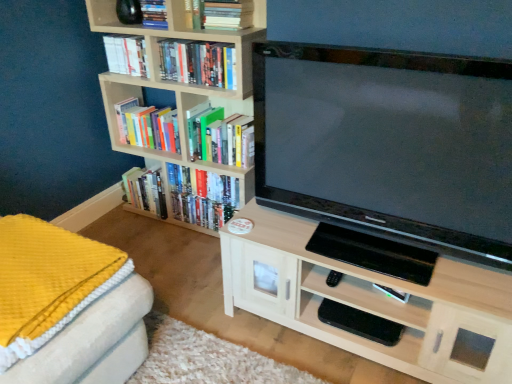
What do you see at coordinates (48, 282) in the screenshot?
I see `yellow textured blanket at lower left` at bounding box center [48, 282].

Measure the distance between point (106,74) and camera.

Point (106,74) is 2.35 meters from camera.

Where is `yellow textured blanket at lower left`? This screenshot has width=512, height=384. yellow textured blanket at lower left is located at coordinates [x=48, y=282].

Is point (193, 143) farther from viewer compared to point (116, 57)?

That is True.

Could you tell me if hardcover book at center, which is the sixth book in top-to-bottom order, is facing hardcover book at upper left, marked as the third book in a top-to-bottom arrangement?

No, hardcover book at center, which is the sixth book in top-to-bottom order, does not turn towards hardcover book at upper left, marked as the third book in a top-to-bottom arrangement.

Is hardcover book at center, placed as the 1th book when sorted from bottom to top, next to hardcover book at upper left, marked as the third book in a top-to-bottom arrangement?

No, hardcover book at center, placed as the 1th book when sorted from bottom to top, is not touching hardcover book at upper left, marked as the third book in a top-to-bottom arrangement.

Is there a large distance between yellow textured blanket at lower left and matte black mouse at upper left, the 2th shelf when ordered from right to left?

That's right, there is a large distance between yellow textured blanket at lower left and matte black mouse at upper left, the 2th shelf when ordered from right to left.

Is yellow textured blanket at lower left located outside matte black mouse at upper left, the 1th shelf in the top-to-bottom sequence?

Yes, yellow textured blanket at lower left is not within matte black mouse at upper left, the 1th shelf in the top-to-bottom sequence.

Where is `shelf that is the 2nd one when counting backward from the yellow textured blanket at lower left`? This screenshot has width=512, height=384. shelf that is the 2nd one when counting backward from the yellow textured blanket at lower left is located at coordinates (106, 17).

Considering the positions of objects wooden bookshelf at left and matte black mouse at upper left, the 2th shelf when ordered from right to left, in the image provided, who is more to the left, wooden bookshelf at left or matte black mouse at upper left, the 2th shelf when ordered from right to left,?

From the viewer's perspective, matte black mouse at upper left, the 2th shelf when ordered from right to left, appears more on the left side.

Based on the photo, which object is thinner, wooden bookshelf at left or matte black mouse at upper left, the 1th shelf in the top-to-bottom sequence?

matte black mouse at upper left, the 1th shelf in the top-to-bottom sequence.

From a real-world perspective, which is physically below, wooden bookshelf at left or matte black mouse at upper left, the 1th shelf in the top-to-bottom sequence?

In real-world perspective, wooden bookshelf at left is lower.

Is wooden bookshelf at left inside or outside of black matte speaker at lower right?

wooden bookshelf at left is outside black matte speaker at lower right.

Considering the sizes of objects wooden bookshelf at left and black matte speaker at lower right in the image provided, who is shorter, wooden bookshelf at left or black matte speaker at lower right?

black matte speaker at lower right.

Is wooden bookshelf at left oriented away from black matte speaker at lower right?

No, wooden bookshelf at left's orientation is not away from black matte speaker at lower right.

From the image's perspective, between wooden bookshelf at left and black matte speaker at lower right, who is located below?

black matte speaker at lower right appears lower in the image.

Which object is thinner, hardcover book at upper center, acting as the 1th book starting from the top, or wooden bookshelf at left?

hardcover book at upper center, acting as the 1th book starting from the top.

Looking at this image, from the image's perspective, is hardcover book at upper center, marked as the 6th book in a bottom-to-top arrangement, located above wooden bookshelf at left?

Yes, from the image's perspective, hardcover book at upper center, marked as the 6th book in a bottom-to-top arrangement, is on top of wooden bookshelf at left.

From a real-world perspective, which book is the 4th one above the wooden bookshelf at left? Please provide its 2D coordinates.

[(154, 14)]

Can you confirm if hardcover book at upper center, marked as the 6th book in a bottom-to-top arrangement, is taller than wooden bookshelf at left?

In fact, hardcover book at upper center, marked as the 6th book in a bottom-to-top arrangement, may be shorter than wooden bookshelf at left.

Would you consider hardcover books at upper left, which is the 5th book in top-to-bottom order, to be distant from wooden bookshelf at left?

They are positioned close to each other.

Is wooden bookshelf at left completely or partially inside hardcover books at upper left, acting as the second book starting from the bottom?

No, wooden bookshelf at left is not a part of hardcover books at upper left, acting as the second book starting from the bottom.

Between hardcover books at upper left, which is the 5th book in top-to-bottom order, and wooden bookshelf at left, which one has larger width?

With larger width is wooden bookshelf at left.

Does hardcover books at upper left, acting as the second book starting from the bottom, have a larger size compared to wooden bookshelf at left?

Incorrect, hardcover books at upper left, acting as the second book starting from the bottom, is not larger than wooden bookshelf at left.

Who is smaller, hardcover book at center, which is the sixth book in top-to-bottom order, or hardcover book at upper center, acting as the 1th book starting from the top?

With smaller size is hardcover book at upper center, acting as the 1th book starting from the top.

From the image's perspective, between hardcover book at center, placed as the 1th book when sorted from bottom to top, and hardcover book at upper center, marked as the 6th book in a bottom-to-top arrangement, who is located below?

hardcover book at center, placed as the 1th book when sorted from bottom to top.

Does hardcover book at center, which is the sixth book in top-to-bottom order, have a lesser height compared to hardcover book at upper center, acting as the 1th book starting from the top?

Incorrect, the height of hardcover book at center, which is the sixth book in top-to-bottom order, does not fall short of that of hardcover book at upper center, acting as the 1th book starting from the top.

Identify the location of the 3rd book positioned above the hardcover book at center, which is the sixth book in top-to-bottom order (from the image's perspective). This screenshot has height=384, width=512. (126, 55).

Image resolution: width=512 pixels, height=384 pixels. Identify the location of blanket that appears below the matte black mouse at upper left, the 2th shelf when ordered from right to left (from a real-world perspective). (48, 282).

Based on their spatial positions, is hardcover books at upper left, which is the 5th book in top-to-bottom order, or matte black tv at center closer to black matte speaker at lower right?

matte black tv at center is closer to black matte speaker at lower right.

Considering their positions, is hardcover book at upper left, marked as the third book in a top-to-bottom arrangement, positioned closer to hardcover book at upper center, acting as the 1th book starting from the top, than black matte speaker at lower right?

The object closer to hardcover book at upper center, acting as the 1th book starting from the top, is hardcover book at upper left, marked as the third book in a top-to-bottom arrangement.

Looking at the image, which one is located closer to hardcover book at center, which is the sixth book in top-to-bottom order, hardcover books at upper center, which appears as the 3th book when ordered from the bottom, or hardcover book at upper center, acting as the 1th book starting from the top?

Based on the image, hardcover books at upper center, which appears as the 3th book when ordered from the bottom, appears to be nearer to hardcover book at center, which is the sixth book in top-to-bottom order.

In the scene shown: From the image, which object appears to be farther from matte black tv at center, wooden bookshelf at left or black matte speaker at lower right?

Among the two, wooden bookshelf at left is located further to matte black tv at center.

From the image, which object appears to be farther from yellow textured blanket at lower left, matte black tv at center or hardcover book at upper center, marked as the 6th book in a bottom-to-top arrangement?

Among the two, hardcover book at upper center, marked as the 6th book in a bottom-to-top arrangement, is located further to yellow textured blanket at lower left.

Which object lies further to the anchor point hardcover book at upper center, placed as the second book when sorted from top to bottom, yellow textured blanket at lower left or hardcover book at center, which is the sixth book in top-to-bottom order?

Based on the image, yellow textured blanket at lower left appears to be further to hardcover book at upper center, placed as the second book when sorted from top to bottom.

Looking at the image, which one is located closer to black matte speaker at lower right, hardcover books at upper center, the 4th book positioned from the top, or yellow textured blanket at lower left?

The object closer to black matte speaker at lower right is yellow textured blanket at lower left.

Estimate the real-world distances between objects in this image. Which object is further from black matte speaker at lower right, light wood cabinet at center, the 2th shelf positioned from the top, or hardcover book at upper center, placed as the second book when sorted from top to bottom?

The object further to black matte speaker at lower right is hardcover book at upper center, placed as the second book when sorted from top to bottom.

Find the location of a particular element. bookcase that lies between hardcover books at upper center, which appears as the 3th book when ordered from the bottom, and hardcover book at center, which is the sixth book in top-to-bottom order, from top to bottom is located at coordinates (170, 81).

Locate an element on the screen. Image resolution: width=512 pixels, height=384 pixels. shelf between hardcover book at upper center, placed as the second book when sorted from top to bottom, and black matte speaker at lower right, in the vertical direction is located at coordinates (371, 294).

Identify the location of television that lies between matte black mouse at upper left, acting as the 2th shelf starting from the bottom, and black matte speaker at lower right from top to bottom. (389, 144).

What are the coordinates of `shelf that lies between matte black tv at center and black matte speaker at lower right from top to bottom` in the screenshot? It's located at 371,294.